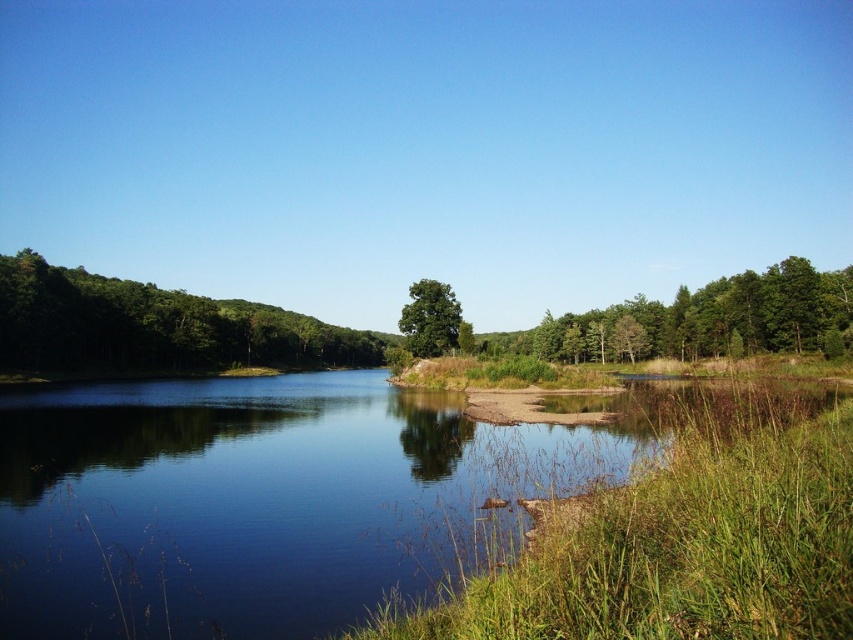
Between clear water at center and green grass at lower right, which one has more height?

With more height is green grass at lower right.

Does point (55, 406) come closer to viewer compared to point (712, 460)?

No, (55, 406) is behind (712, 460).

Where is `clear water at center`? clear water at center is located at coordinates 263,499.

Does clear water at center appear over green matte tree at left?

Actually, clear water at center is below green matte tree at left.

Can you confirm if clear water at center is positioned to the right of green matte tree at left?

Correct, you'll find clear water at center to the right of green matte tree at left.

Does point (474, 524) come closer to viewer compared to point (114, 298)?

Yes, it is in front of point (114, 298).

Locate an element on the screen. clear water at center is located at coordinates (263, 499).

Does green leafy tree at right have a smaller size compared to green leafy tree at center?

No.

Does green leafy tree at right lie behind green leafy tree at center?

No, green leafy tree at right is in front of green leafy tree at center.

Is point (772, 332) positioned after point (425, 307)?

That is True.

Identify the location of green leafy tree at right. (703, 317).